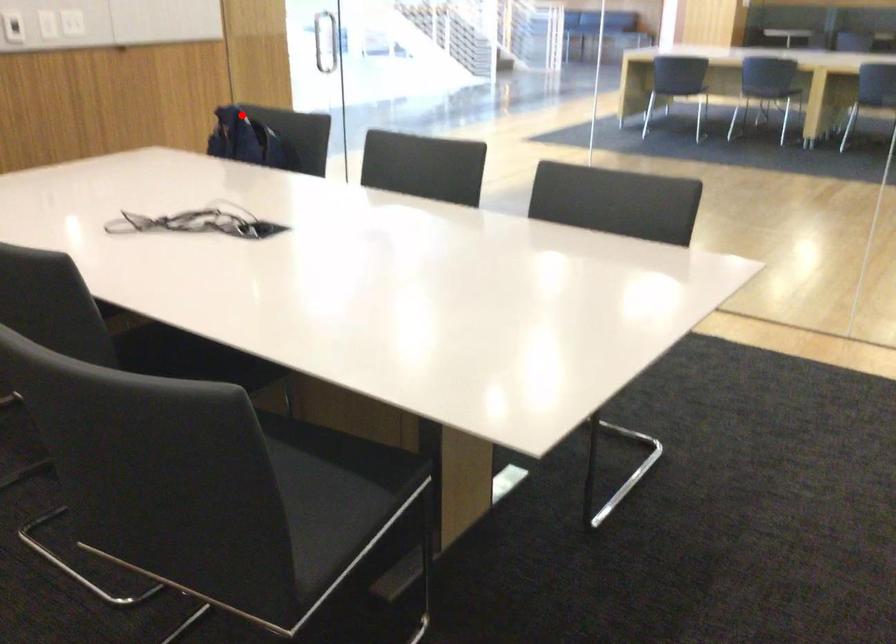
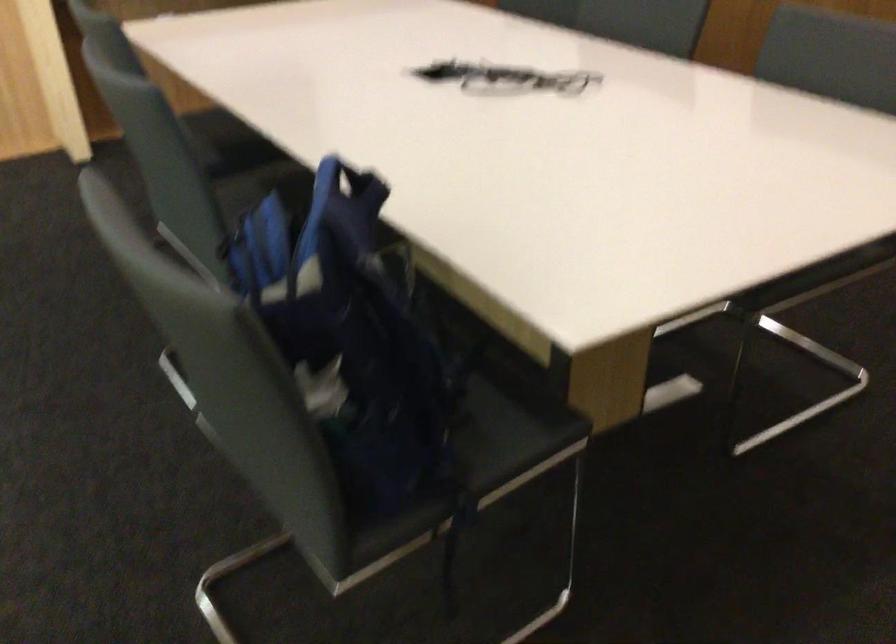
Question: I am providing you with two images of the same scene from different viewpoints. Given a red point in image1, look at the same physical point in image2. Is it:

Choices:
 (A) Closer to the viewpoint
 (B) Farther from the viewpoint

Answer: (A)